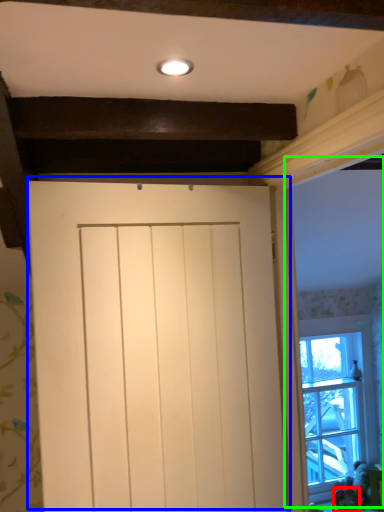
Question: Which object is positioned closest to animal (highlighted by a red box)? Select from door (highlighted by a blue box) and window frame (highlighted by a green box).

Choices:
 (A) door
 (B) window frame

Answer: (B)